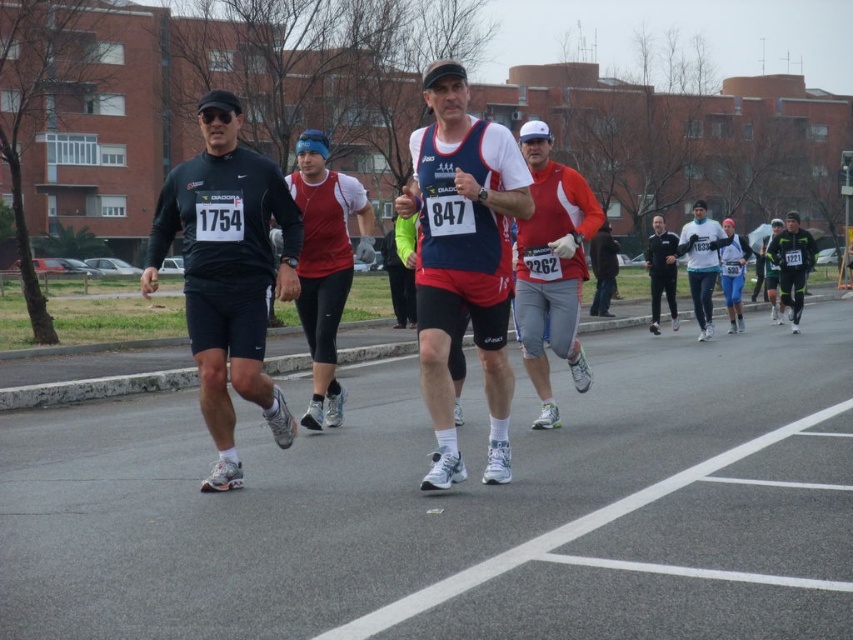
You are a photographer positioned at the starting line of the marathon. You want to capture a photo of the matte blue tank top at center and the matte black jacket at center. Which runner will appear larger in your photo?

The matte blue tank top at center is closer to the viewer than the matte black jacket at center, so it will appear larger in the photo.

You are a photographer at the marathon event. You want to take a photo that includes both the matte red shirt at center and the red matte running top at center. Which of the two objects should you focus on to ensure both are clearly visible in the frame?

To ensure both the matte red shirt at center and the red matte running top at center are clearly visible in the frame, focus on the red matte running top at center since it occupies more space and will be easier to capture while also including the smaller matte red shirt at center.